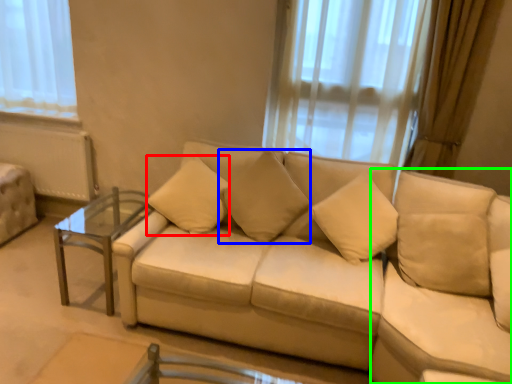
Question: Based on their relative distances, which object is farther from pillow (highlighted by a red box)? Choose from pillow (highlighted by a blue box) and swivel chair (highlighted by a green box).

Choices:
 (A) pillow
 (B) swivel chair

Answer: (B)